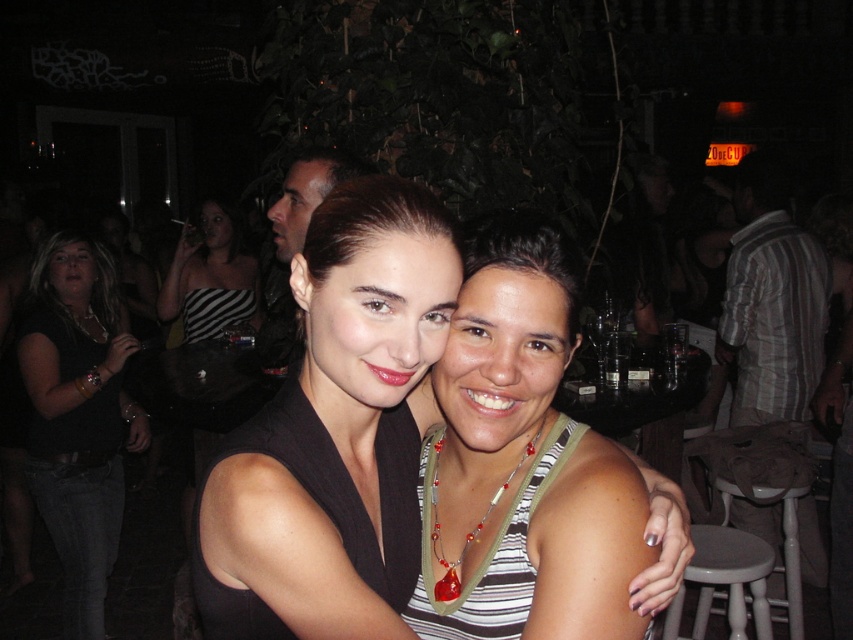
Question: Does black matte dress at center have a smaller size compared to black matte dress at left?

Choices:
 (A) yes
 (B) no

Answer: (A)

Question: Does black matte dress at center appear under black matte dress at left?

Choices:
 (A) no
 (B) yes

Answer: (A)

Question: Does striped fabric dress at center appear under translucent green lanyard at center?

Choices:
 (A) no
 (B) yes

Answer: (A)

Question: Which point appears closest to the camera in this image?

Choices:
 (A) (509, 476)
 (B) (38, 268)
 (C) (392, 390)
 (D) (190, 333)

Answer: (C)

Question: Based on their relative distances, which object is farther from the translucent green lanyard at center?

Choices:
 (A) striped fabric dress at center
 (B) black matte dress at left
 (C) black matte dress at center

Answer: (A)

Question: Which object is farther from the camera taking this photo?

Choices:
 (A) black matte dress at center
 (B) translucent green lanyard at center

Answer: (B)